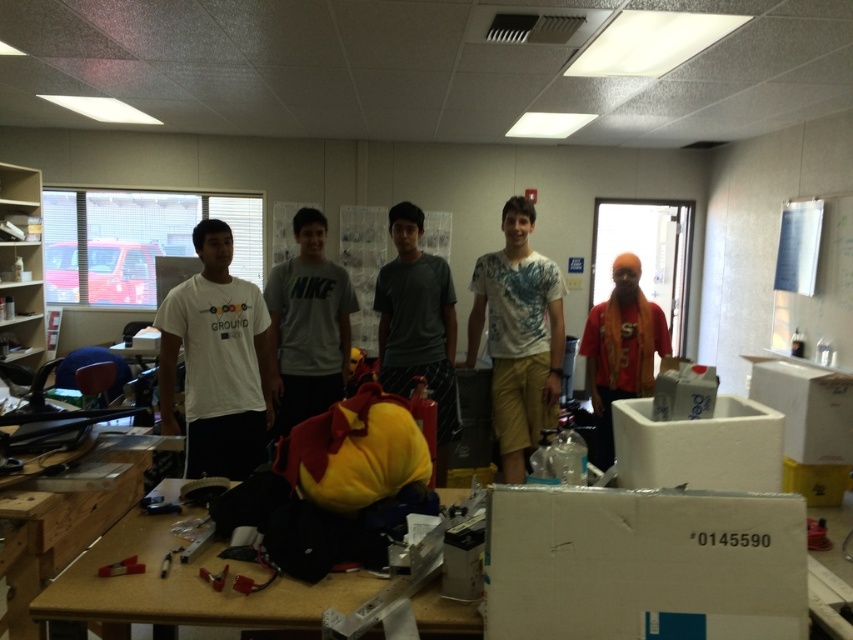
Can you confirm if white matte t-shirt at left is wider than metallic red screwdriver at lower left?

Indeed, white matte t-shirt at left has a greater width compared to metallic red screwdriver at lower left.

The image size is (853, 640). What do you see at coordinates (216, 362) in the screenshot? I see `white matte t-shirt at left` at bounding box center [216, 362].

Identify the location of white matte t-shirt at left. (216, 362).

Who is more distant from viewer, (619,269) or (134,556)?

The point (619,269) is more distant.

Is orange fabric shirt at right positioned behind metallic red screwdriver at lower left?

Yes, orange fabric shirt at right is further from the viewer.

Which is behind, point (608, 356) or point (107, 566)?

Positioned behind is point (608, 356).

Where is `orange fabric shirt at right`? This screenshot has height=640, width=853. orange fabric shirt at right is located at coordinates (619, 349).

Looking at this image, who is taller, white printed t-shirt at center or orange fabric shirt at right?

Standing taller between the two is white printed t-shirt at center.

Does white printed t-shirt at center lie behind orange fabric shirt at right?

No, it is not.

Between point (497, 326) and point (640, 312), which one is positioned in front?

Point (497, 326) is more forward.

Locate an element on the screen. white printed t-shirt at center is located at coordinates (518, 336).